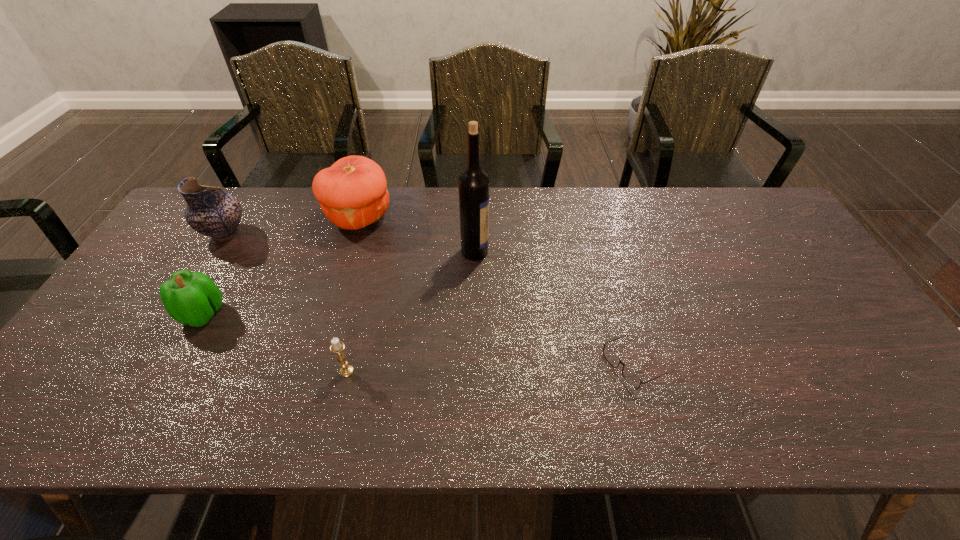
Identify the location of wine bottle. (473, 183).

The height and width of the screenshot is (540, 960). Identify the location of the second object from right to left. (473, 183).

Where is `pumpkin`? pumpkin is located at coordinates (x=352, y=193).

This screenshot has height=540, width=960. I want to click on pottery, so click(210, 211).

The height and width of the screenshot is (540, 960). What are the coordinates of `the fourth farthest object` in the screenshot? It's located at (191, 298).

I want to click on candle holder, so click(x=337, y=347).

The height and width of the screenshot is (540, 960). Find the location of `spectacles`. spectacles is located at coordinates (611, 357).

At what (x,y) coordinates should I click in order to perform the action: click on the rightmost object. Please return your answer as a coordinate pair (x, y). The width and height of the screenshot is (960, 540). Looking at the image, I should click on (611, 357).

I want to click on vacant area situated on the label of the wine bottle, so 563,252.

This screenshot has width=960, height=540. I want to click on vacant space located on the left of the pumpkin, so click(251, 217).